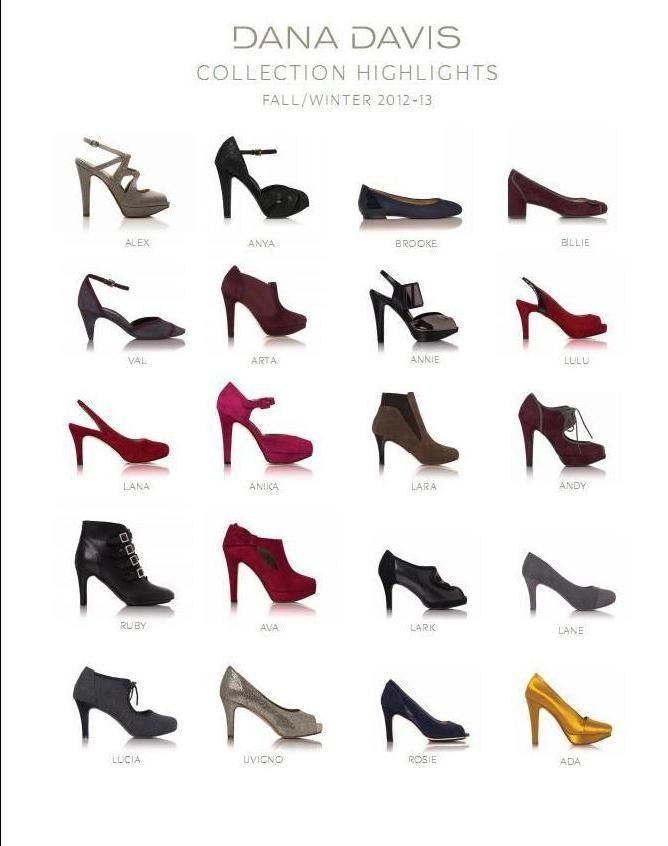
This screenshot has width=668, height=846. Identify the location of shoes in the bottom row. pos(130,713), pos(285,718), pos(442,726), pos(580,726).